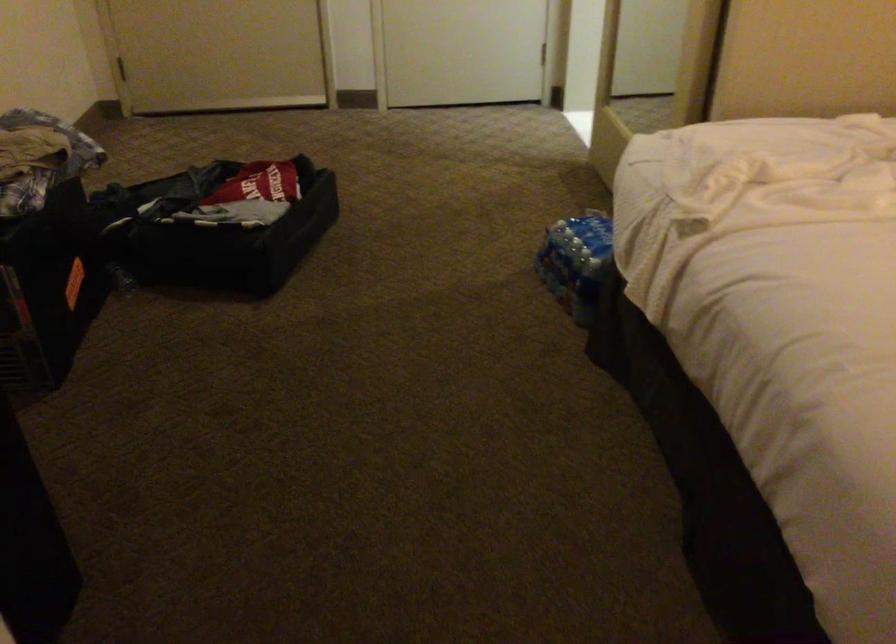
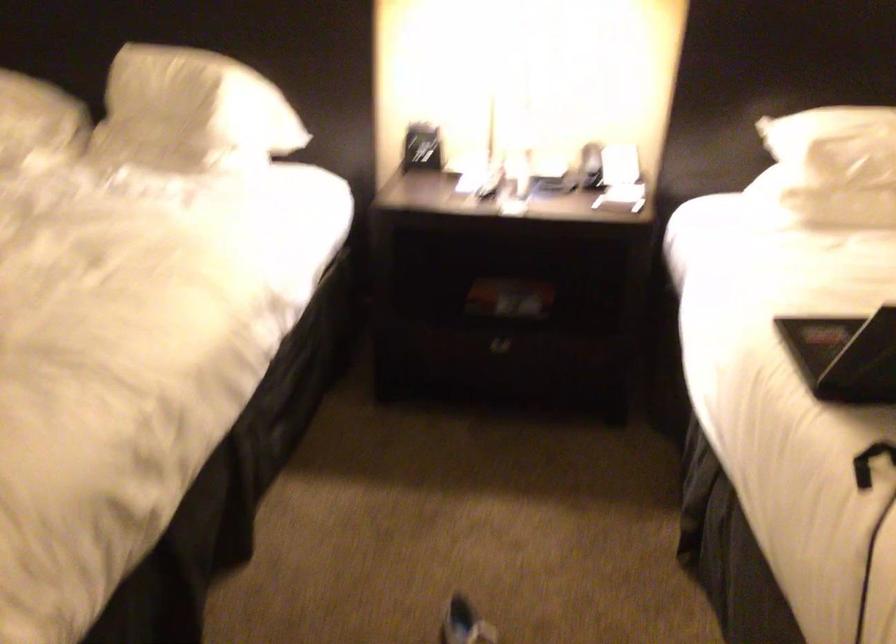
Question: Based on the continuous images, in which direction is the camera rotating? Reply with the corresponding letter.

Choices:
 (A) Left
 (B) Right
 (C) Up
 (D) Down

Answer: (B)